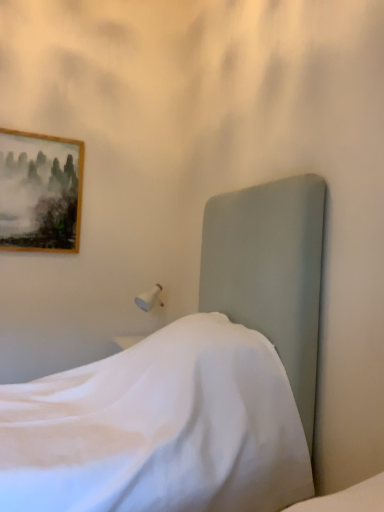
Question: Should I look upward or downward to see wooden framed painting at upper left?

Choices:
 (A) down
 (B) up

Answer: (B)

Question: Is wooden framed painting at upper left located within satin white bed at center?

Choices:
 (A) yes
 (B) no

Answer: (B)

Question: From a real-world perspective, is satin white bed at center located higher than wooden framed painting at upper left?

Choices:
 (A) yes
 (B) no

Answer: (B)

Question: From the image's perspective, is satin white bed at center over wooden framed painting at upper left?

Choices:
 (A) yes
 (B) no

Answer: (B)

Question: Can you confirm if satin white bed at center is bigger than wooden framed painting at upper left?

Choices:
 (A) no
 (B) yes

Answer: (B)

Question: Can you confirm if satin white bed at center is thinner than wooden framed painting at upper left?

Choices:
 (A) no
 (B) yes

Answer: (A)

Question: Is satin white bed at center positioned beyond the bounds of wooden framed painting at upper left?

Choices:
 (A) no
 (B) yes

Answer: (B)

Question: Can you confirm if wooden framed painting at upper left is taller than satin white bed at center?

Choices:
 (A) no
 (B) yes

Answer: (A)

Question: Considering the relative sizes of wooden framed painting at upper left and satin white bed at center in the image provided, is wooden framed painting at upper left shorter than satin white bed at center?

Choices:
 (A) yes
 (B) no

Answer: (A)

Question: Is wooden framed painting at upper left further to camera compared to satin white bed at center?

Choices:
 (A) no
 (B) yes

Answer: (B)

Question: Could you tell me if wooden framed painting at upper left is facing satin white bed at center?

Choices:
 (A) no
 (B) yes

Answer: (B)

Question: Considering the relative sizes of wooden framed painting at upper left and satin white bed at center in the image provided, is wooden framed painting at upper left wider than satin white bed at center?

Choices:
 (A) yes
 (B) no

Answer: (B)

Question: Is wooden framed painting at upper left outside of satin white bed at center?

Choices:
 (A) yes
 (B) no

Answer: (A)

Question: Is wooden framed painting at upper left inside or outside of satin white bed at center?

Choices:
 (A) inside
 (B) outside

Answer: (B)